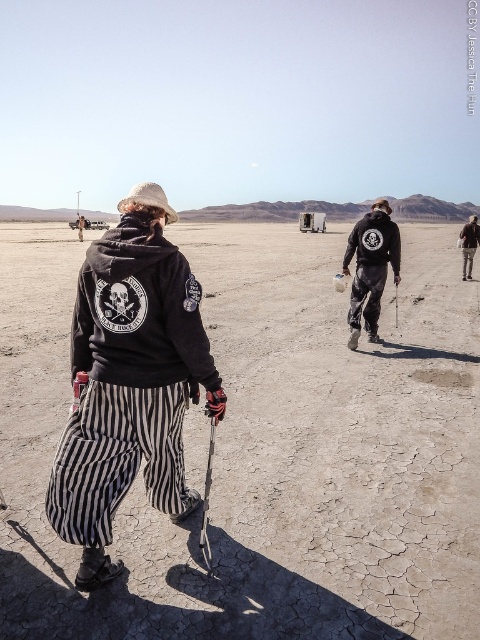
Can you confirm if matte black jacket at center is positioned to the left of silver metallic ski pole at center-right?

Yes, matte black jacket at center is to the left of silver metallic ski pole at center-right.

Is point (359, 244) closer to camera compared to point (395, 276)?

Yes, point (359, 244) is closer to viewer.

Which is in front, point (344, 257) or point (396, 288)?

Positioned in front is point (344, 257).

Locate an element on the screen. The image size is (480, 640). matte black jacket at center is located at coordinates (371, 268).

Which of these two, black cotton hoodie at center or silver metallic ski pole at center-right, stands shorter?

silver metallic ski pole at center-right is shorter.

Can you confirm if black cotton hoodie at center is smaller than silver metallic ski pole at center-right?

Yes, black cotton hoodie at center is smaller than silver metallic ski pole at center-right.

Does point (122, 444) come in front of point (396, 289)?

That is True.

This screenshot has width=480, height=640. In order to click on black cotton hoodie at center in this screenshot , I will do `click(130, 381)`.

Which of these two, black fleece sweatshirt at back or matte black jacket at center, stands shorter?

With less height is black fleece sweatshirt at back.

Is black fleece sweatshirt at back to the left of matte black jacket at center from the viewer's perspective?

Indeed, black fleece sweatshirt at back is positioned on the left side of matte black jacket at center.

You are a GUI agent. You are given a task and a screenshot of the screen. Output one action in this format:
    pyautogui.click(x=<x>, y=<y>)
    Task: Click on the black fleece sweatshirt at back
    The height and width of the screenshot is (640, 480).
    Given the screenshot: What is the action you would take?
    pyautogui.click(x=139, y=310)

At what (x,y) coordinates should I click in order to perform the action: click on black fleece sweatshirt at back. Please return your answer as a coordinate pair (x, y). The image size is (480, 640). Looking at the image, I should click on (139, 310).